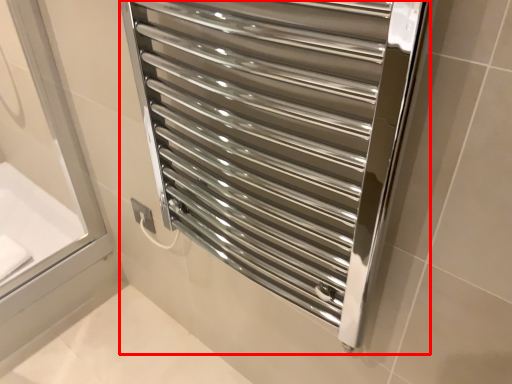
Question: From the image's perspective, what is the correct spatial relationship of towel rack (annotated by the red box) in relation to bath?

Choices:
 (A) below
 (B) above

Answer: (B)